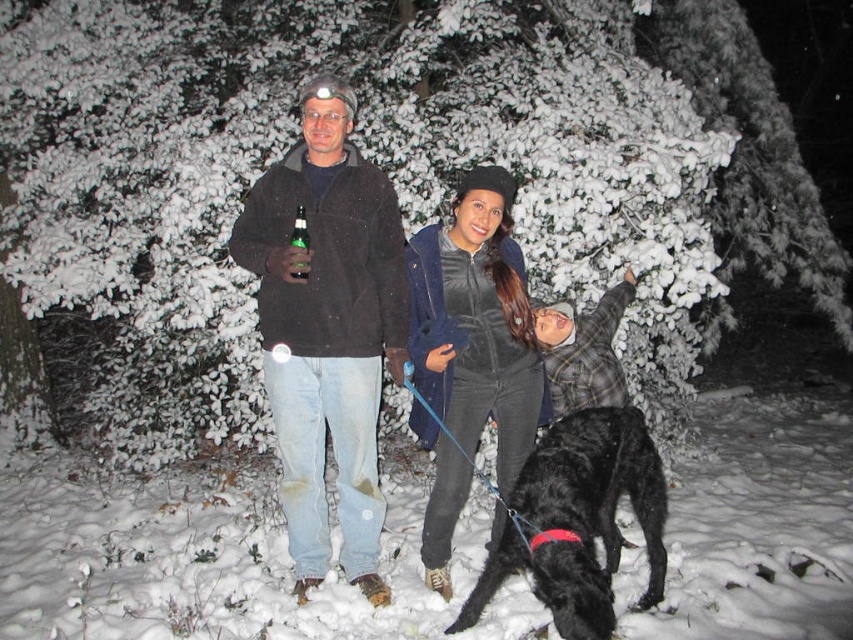
In the scene shown: You are a photographer setting up a tripod in the snowy area. You want to ensure that both the velvet black jacket at center and the green glass bottle at center are visible in your shot. Given their sizes, which object will appear larger in the photo?

The velvet black jacket at center is taller than the green glass bottle at center, so it will appear larger in the photo.

You are trying to decide whether to place the velvet black jacket at center and the green glass bottle at center on a narrow shelf. Which object should you place first to ensure both fit?

The velvet black jacket at center is wider than the green glass bottle at center, so you should place the wider velvet black jacket at center first to ensure both fit on the narrow shelf.

You are trying to decide which item to grab first from the snowy scene. The velvet black jacket at center and the shiny black fur at center are both in your line of sight. Which one is easier to reach if you are standing closer to the smaller object?

The velvet black jacket at center is smaller than the shiny black fur at center, so if you are standing closer to the smaller object, the velvet black jacket at center would be easier to reach.